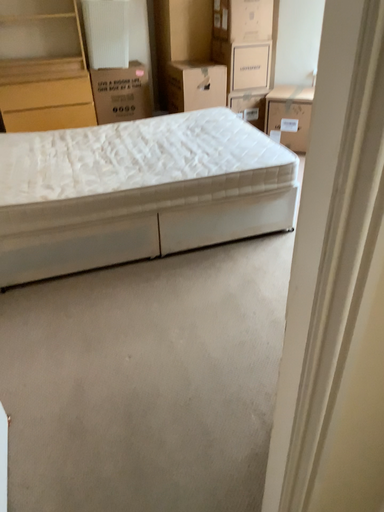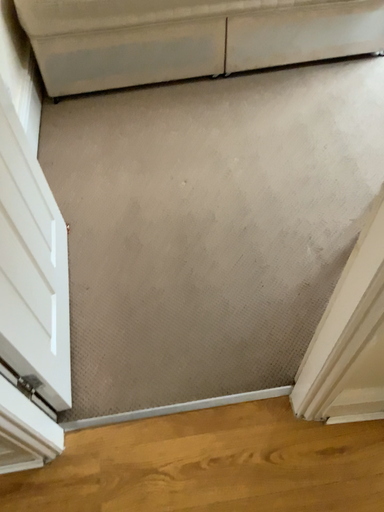
Question: Which way did the camera rotate in the video?

Choices:
 (A) rotated downward
 (B) rotated upward

Answer: (A)